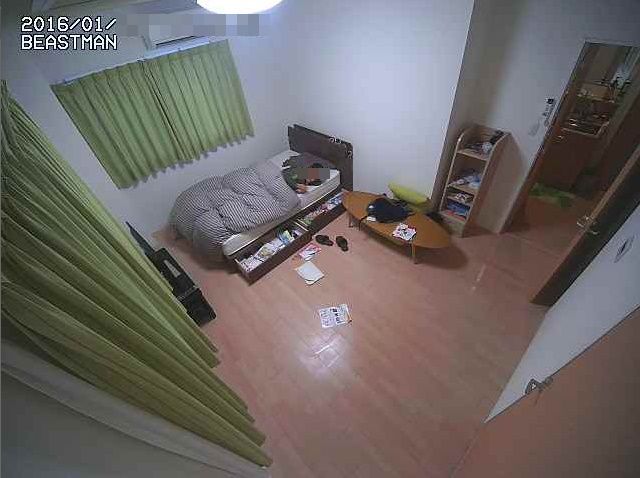
The height and width of the screenshot is (478, 640). I want to click on narrow shelf, so click(x=466, y=170).